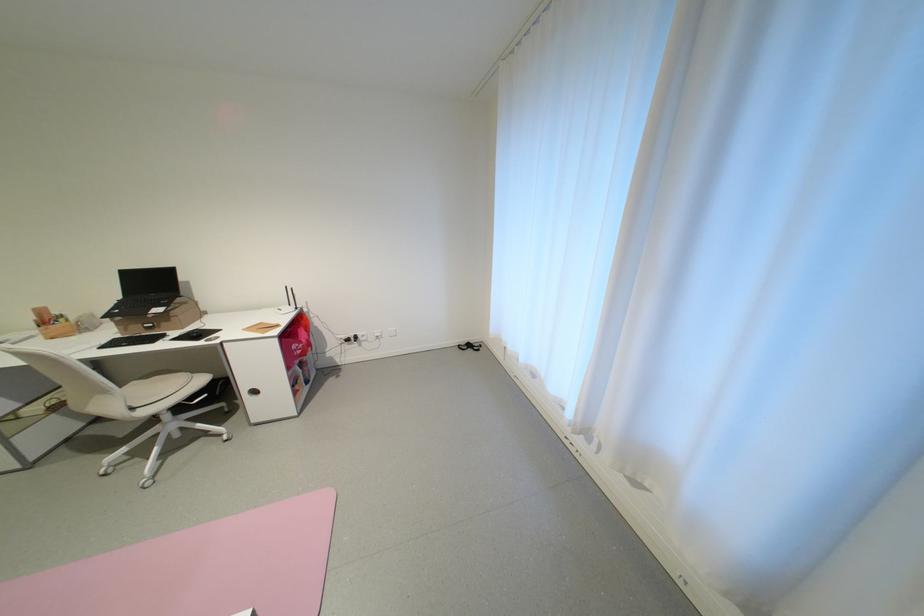
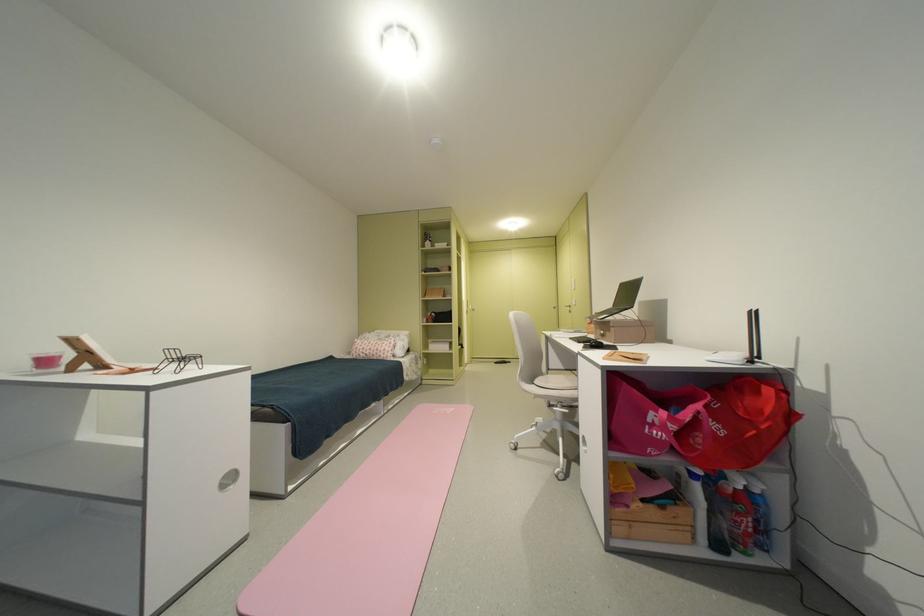
Locate, in the second image, the point that corresponds to (309,392) in the first image.

(638, 508)